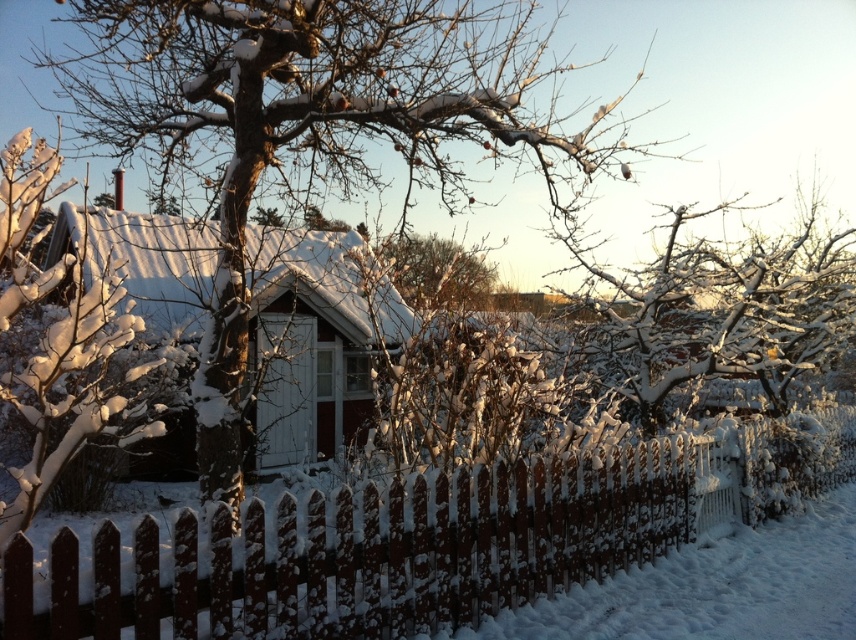
Is white picket fence at center shorter than red wooden hut at center?

Correct, white picket fence at center is not as tall as red wooden hut at center.

Locate an element on the screen. white picket fence at center is located at coordinates (418, 540).

Which is in front, point (348, 502) or point (88, 240)?

Point (348, 502) is more forward.

This screenshot has width=856, height=640. What are the coordinates of `white picket fence at center` in the screenshot? It's located at (418, 540).

Does white picket fence at center lie behind white frosty branches at center?

No, white picket fence at center is closer to the viewer.

Is point (324, 627) closer to camera compared to point (400, 280)?

Yes, point (324, 627) is in front of point (400, 280).

Locate an element on the screen. This screenshot has height=640, width=856. white picket fence at center is located at coordinates (418, 540).

Who is taller, red wooden hut at center or white snow-covered tree at left?

red wooden hut at center is taller.

Find the location of a particular element. red wooden hut at center is located at coordinates click(314, 340).

Between point (149, 316) and point (27, 182), which one is positioned behind?

Point (149, 316)

Identify the location of red wooden hut at center. (314, 340).